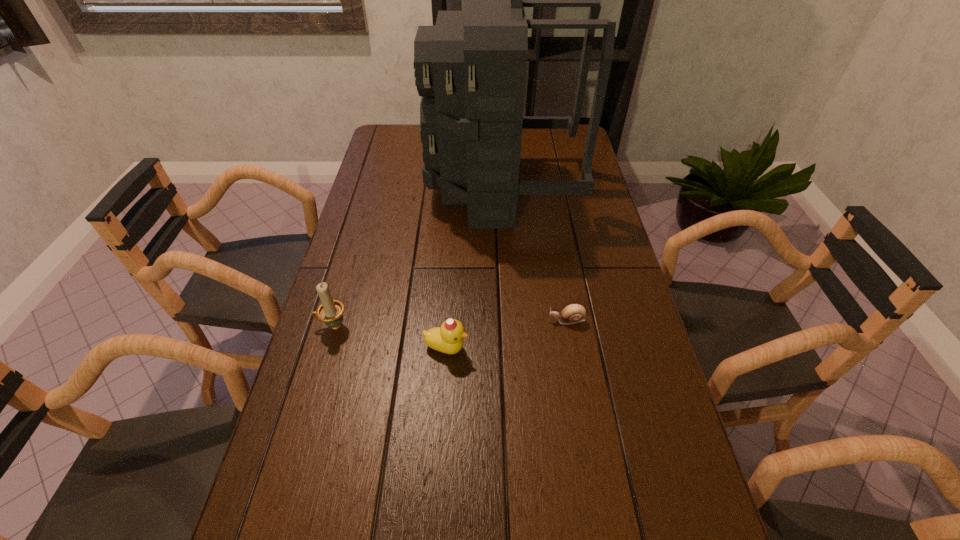
The image size is (960, 540). In the image, there is a desktop. Find the location of `blank space at the right edge`. blank space at the right edge is located at coordinates (621, 521).

This screenshot has height=540, width=960. I want to click on free point at the far left corner, so click(x=400, y=136).

In the image, there is a desktop. At what (x,y) coordinates should I click in order to perform the action: click on vacant space at the far right corner. Please return your answer as a coordinate pair (x, y). Looking at the image, I should click on (550, 140).

This screenshot has width=960, height=540. Find the location of `empty space between the third tallest object and the tallest object`. empty space between the third tallest object and the tallest object is located at coordinates (474, 269).

Find the location of a particular element. This screenshot has height=540, width=960. free space between the tallest object and the leftmost object is located at coordinates (418, 258).

The width and height of the screenshot is (960, 540). What are the coordinates of `vacant space in between the tallest object and the duckling` in the screenshot? It's located at (474, 269).

Image resolution: width=960 pixels, height=540 pixels. I want to click on free area in between the duckling and the shortest object, so click(507, 334).

You are a GUI agent. You are given a task and a screenshot of the screen. Output one action in this format:
    pyautogui.click(x=<x>, y=<y>)
    Task: Click on the empty location between the duckling and the third shortest object
    The width and height of the screenshot is (960, 540).
    Given the screenshot: What is the action you would take?
    pyautogui.click(x=390, y=337)

Locate an element on the screen. The width and height of the screenshot is (960, 540). free spot between the tallest object and the shortest object is located at coordinates (535, 255).

Identify the location of vacant space that's between the shortest object and the duckling. The height and width of the screenshot is (540, 960). (507, 334).